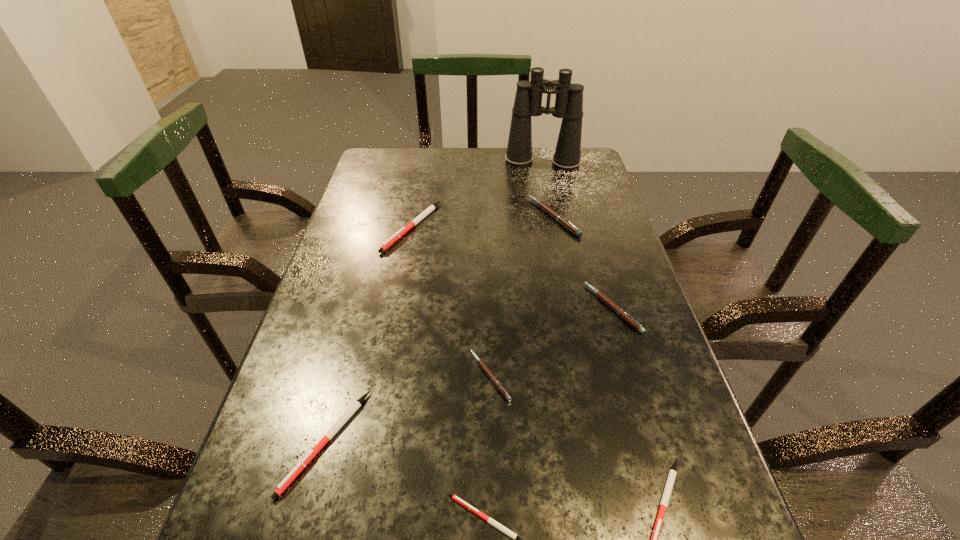
Find the location of a particular element. The height and width of the screenshot is (540, 960). object at the far edge is located at coordinates (569, 97).

Image resolution: width=960 pixels, height=540 pixels. What are the coordinates of `binoculars situated at the right edge` in the screenshot? It's located at (569, 97).

Locate an element on the screen. object at the far right corner is located at coordinates (569, 97).

Find the location of a particular element. free spot at the far edge of the desktop is located at coordinates (496, 155).

Locate an element on the screen. The height and width of the screenshot is (540, 960). vacant space at the left edge of the desktop is located at coordinates (350, 202).

Identify the location of vacant region at the right edge of the desktop. Image resolution: width=960 pixels, height=540 pixels. coord(638,442).

Where is `free space at the far left corner of the desktop`? The height and width of the screenshot is (540, 960). free space at the far left corner of the desktop is located at coordinates (401, 168).

Where is `free region at the far right corner`? This screenshot has height=540, width=960. free region at the far right corner is located at coordinates (553, 152).

Image resolution: width=960 pixels, height=540 pixels. Find the location of `unoccupied area between the tallest object and the smallest pink pen`. unoccupied area between the tallest object and the smallest pink pen is located at coordinates (516, 269).

You are a GUI agent. You are given a task and a screenshot of the screen. Output one action in this format:
    pyautogui.click(x=<x>, y=<y>)
    Task: Click on the empty space between the fifth nearest pen and the third smallest white pen
    This screenshot has height=540, width=960.
    Given the screenshot: What is the action you would take?
    tap(469, 375)